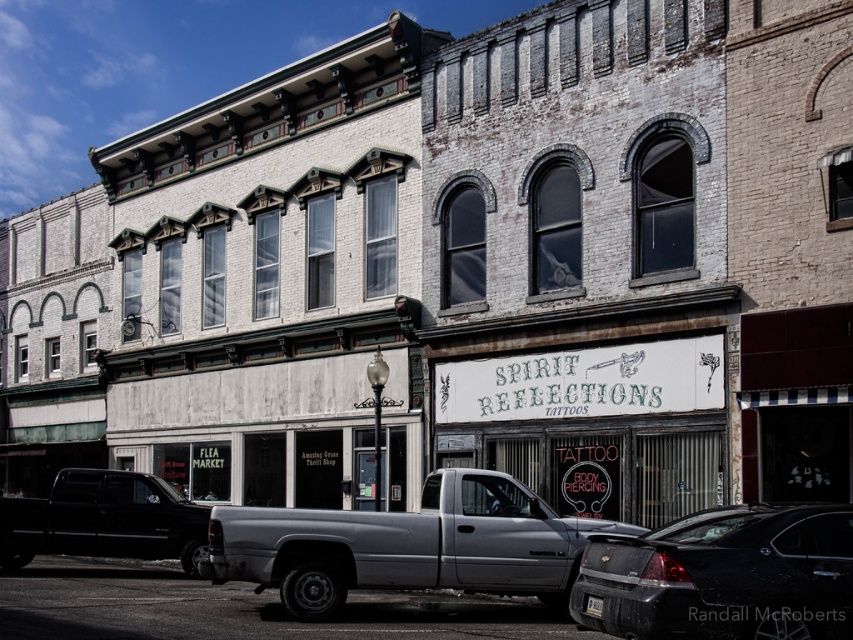
Question: Does silver metallic truck at center appear over matte black truck at lower left?

Choices:
 (A) no
 (B) yes

Answer: (B)

Question: Among these objects, which one is nearest to the camera?

Choices:
 (A) black glossy sedan at lower right
 (B) matte black truck at lower left
 (C) silver metallic truck at center

Answer: (A)

Question: Can you confirm if silver metallic truck at center is smaller than matte black truck at lower left?

Choices:
 (A) yes
 (B) no

Answer: (B)

Question: Considering the real-world distances, which object is farthest from the black glossy sedan at lower right?

Choices:
 (A) matte black truck at lower left
 (B) silver metallic truck at center

Answer: (A)

Question: From the image, what is the correct spatial relationship of silver metallic truck at center in relation to matte black truck at lower left?

Choices:
 (A) left
 (B) right

Answer: (B)

Question: Which of the following is the farthest from the observer?

Choices:
 (A) (91, 509)
 (B) (457, 560)

Answer: (A)